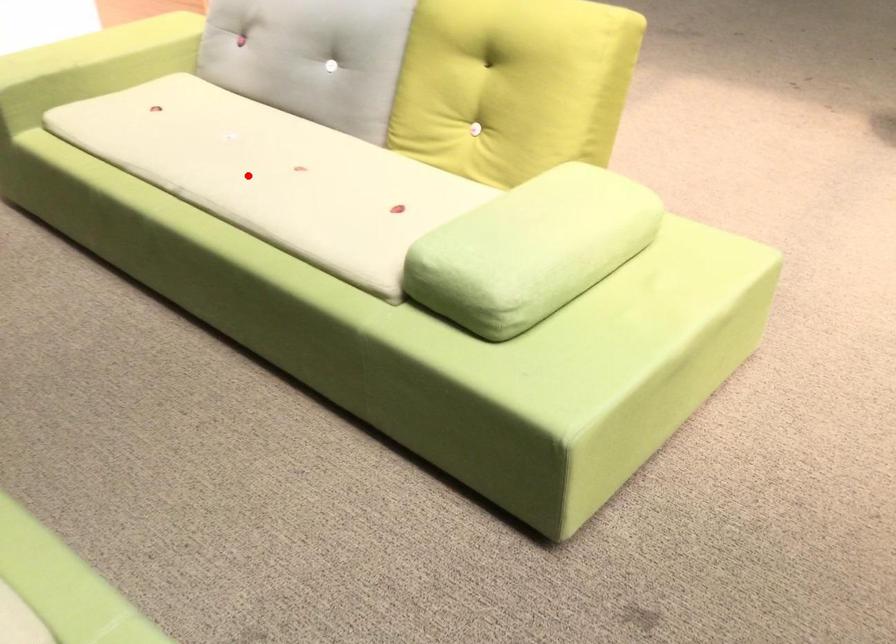
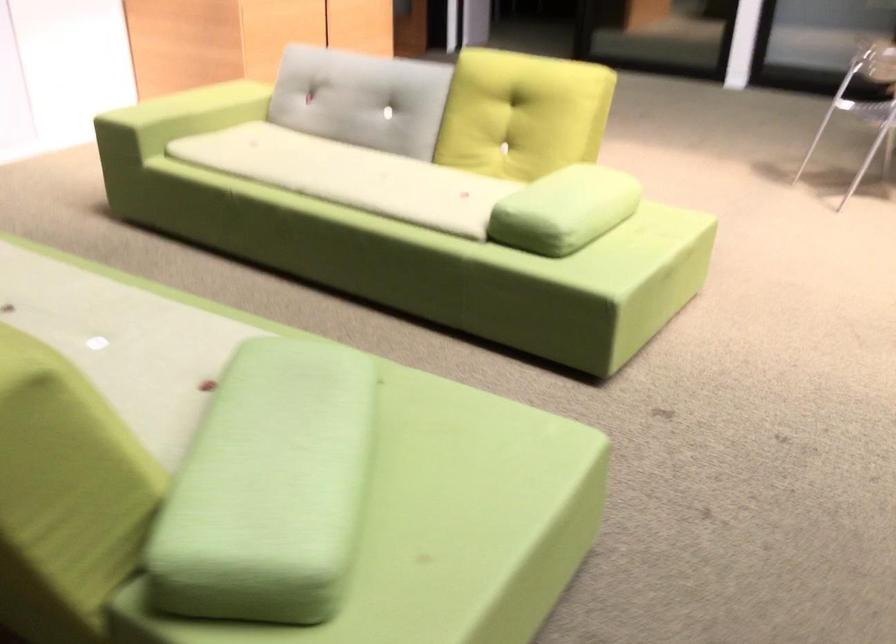
Find the pixel in the second image that matches the highlighted location in the first image.

(349, 176)